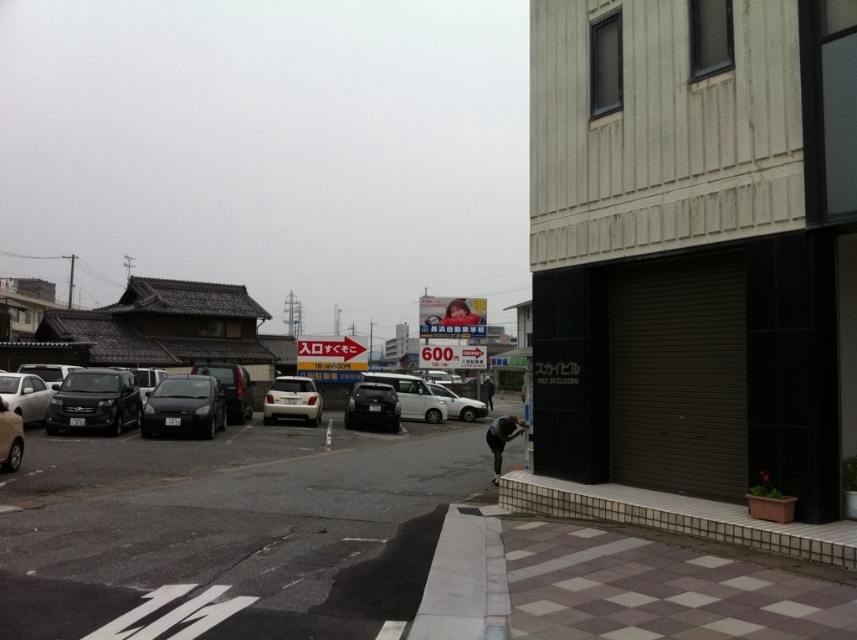
Question: Among these objects, which one is farthest from the camera?

Choices:
 (A) matte silver car at left
 (B) shiny black car at center
 (C) silver metallic car at left
 (D) satin white car at center

Answer: (D)

Question: Can you confirm if black matte car at center-left is positioned below silver metallic car at left?

Choices:
 (A) yes
 (B) no

Answer: (A)

Question: Is black matte car at center-left positioned in front of satin white car at center?

Choices:
 (A) no
 (B) yes

Answer: (B)

Question: Is satin white car at center above shiny black car at center?

Choices:
 (A) no
 (B) yes

Answer: (B)

Question: Among these points, which one is farthest from the camera?

Choices:
 (A) (121, 412)
 (B) (3, 467)

Answer: (A)

Question: Which of these objects is positioned closest to the black matte car at center-left?

Choices:
 (A) satin white car at center
 (B) matte silver car at left
 (C) matte black suv at left

Answer: (C)